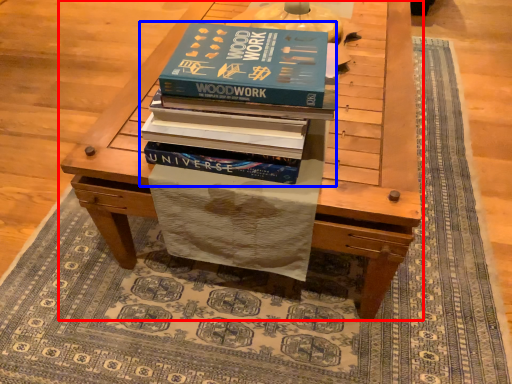
Question: Among these objects, which one is farthest to the camera, table (highlighted by a red box) or book (highlighted by a blue box)?

Choices:
 (A) table
 (B) book

Answer: (A)